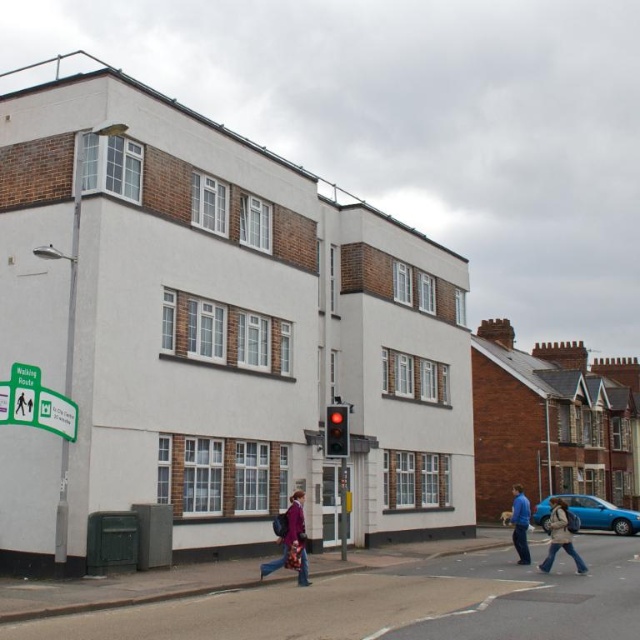
You are a pedestrian waiting at the crosswalk. You notice a denim jacket at lower right and a red glass traffic light at center. Which object is nearer to you?

The denim jacket at lower right is closer to the viewer than the red glass traffic light at center.

You are a pedestrian waiting at the crosswalk and see the purple fabric coat at center and the red glass traffic light at center. Which object is closer to your left side?

The purple fabric coat at center is positioned on the left side of the red glass traffic light at center, so it is closer to your left side.